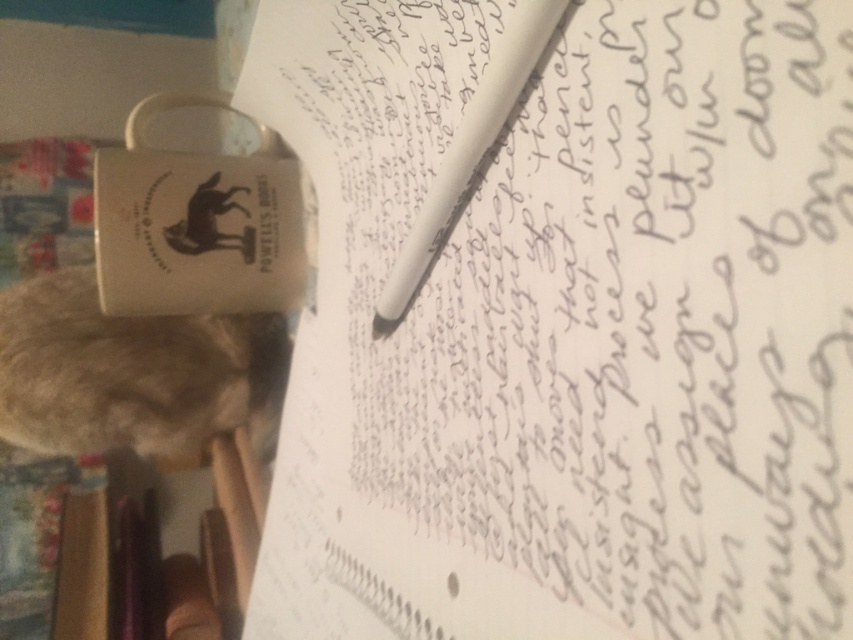
Question: Which point is farther to the camera?

Choices:
 (A) white matte pen at center
 (B) fuzzy fur cat at lower left
 (C) white paper at center

Answer: (B)

Question: Which object is positioned farthest from the white paper at center?

Choices:
 (A) fuzzy fur cat at lower left
 (B) white matte pen at center

Answer: (A)

Question: Is white paper at center to the right of fuzzy fur cat at lower left from the viewer's perspective?

Choices:
 (A) yes
 (B) no

Answer: (A)

Question: Is the position of fuzzy fur cat at lower left less distant than that of white matte pen at center?

Choices:
 (A) no
 (B) yes

Answer: (A)

Question: Does white paper at center appear on the right side of white matte pen at center?

Choices:
 (A) yes
 (B) no

Answer: (B)

Question: Among these objects, which one is nearest to the camera?

Choices:
 (A) white paper at center
 (B) fuzzy fur cat at lower left
 (C) white matte pen at center

Answer: (A)